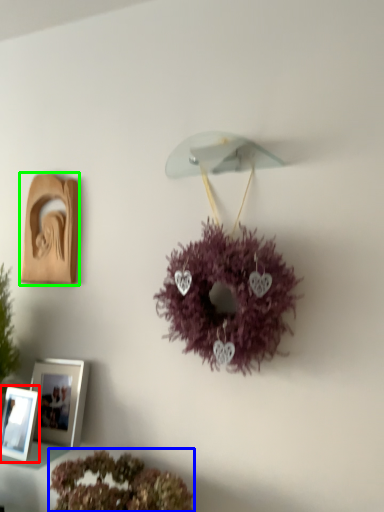
Question: Considering the real-world distances, which object is closest to picture frame (highlighted by a red box)? flower (highlighted by a blue box) or picture frame (highlighted by a green box).

Choices:
 (A) flower
 (B) picture frame

Answer: (A)